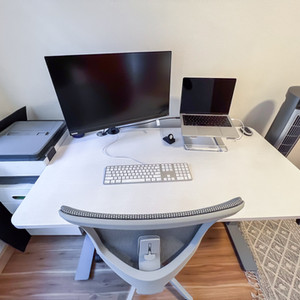
Find the location of a particular element. This screenshot has width=300, height=300. wooden floor is located at coordinates (219, 281).